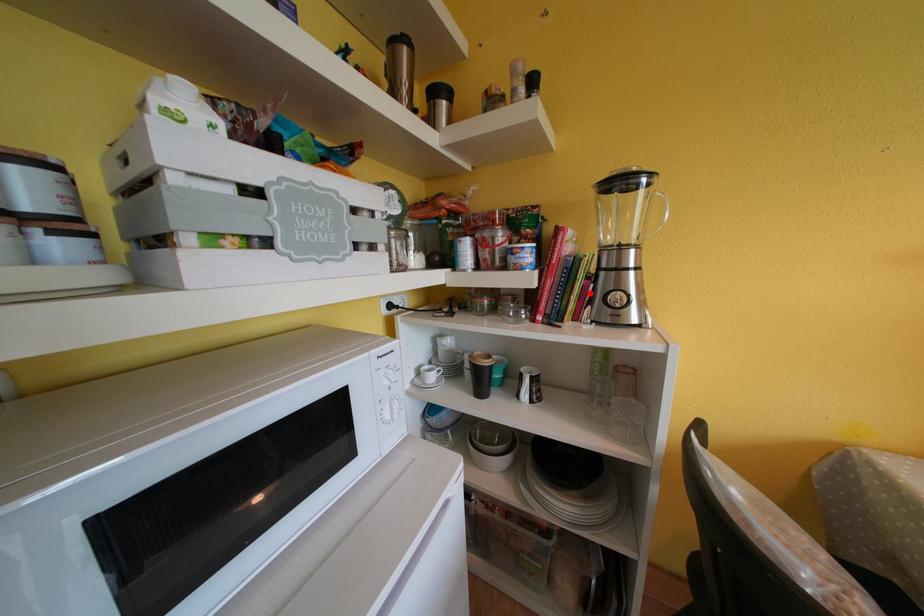
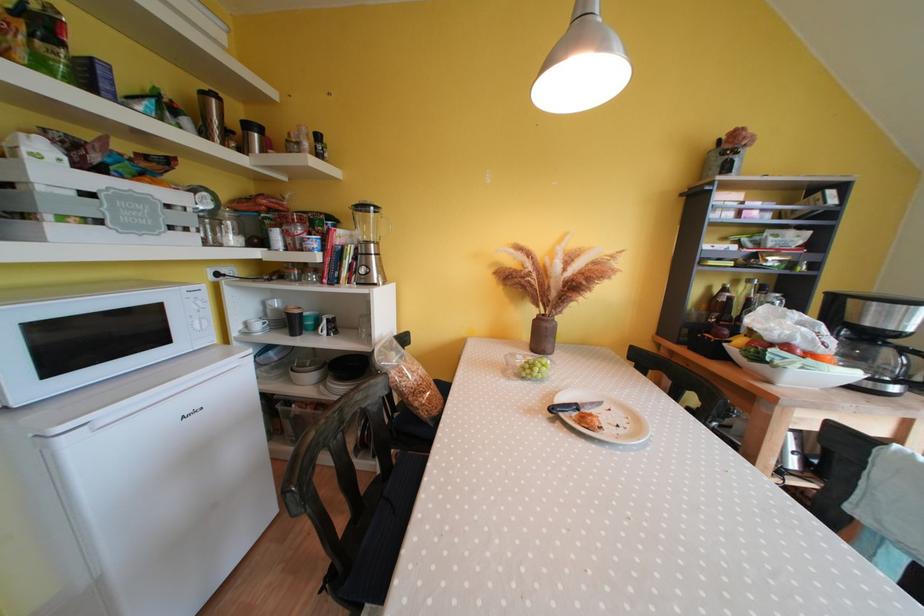
Where in the second image is the point corresponding to the highlighted location from the first image?

(357, 269)